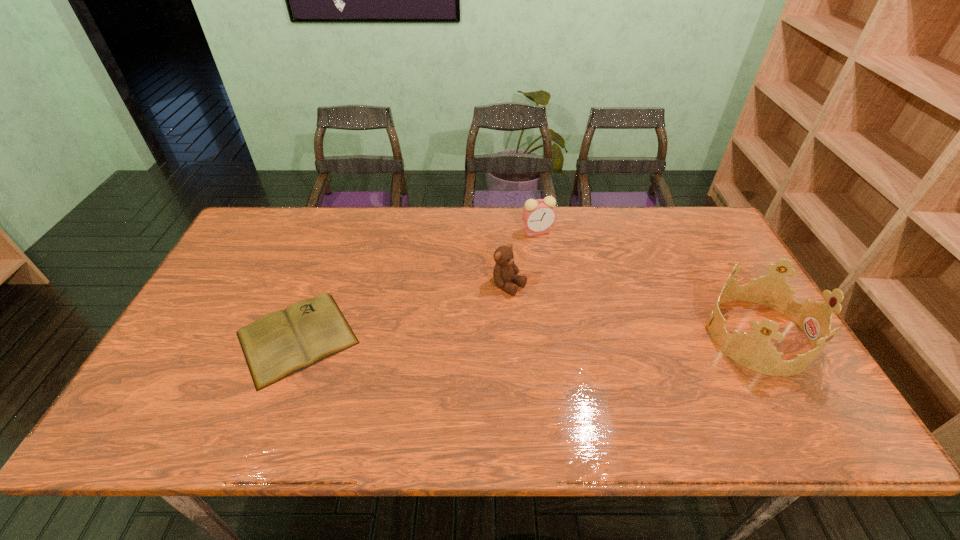
The image size is (960, 540). Identify the location of free space between the teddy bear and the farthest object. (523, 258).

Locate an element on the screen. vacant area that lies between the third object from right to left and the farthest object is located at coordinates (523, 258).

The height and width of the screenshot is (540, 960). Find the location of `free spot between the shortest object and the third object from right to left`. free spot between the shortest object and the third object from right to left is located at coordinates (403, 312).

You are a GUI agent. You are given a task and a screenshot of the screen. Output one action in this format:
    pyautogui.click(x=<x>, y=<y>)
    Task: Click on the free space between the teddy bear and the book
    The image size is (960, 540).
    Given the screenshot: What is the action you would take?
    pyautogui.click(x=403, y=312)

This screenshot has width=960, height=540. In order to click on free space that is in between the teddy bear and the book in this screenshot , I will do `click(403, 312)`.

I want to click on free space between the book and the third object from left to right, so click(x=418, y=284).

Locate which object is the second closest to the tiara. Please provide its 2D coordinates. Your answer should be formatted as a tuple, i.e. [(x, y)], where the tuple contains the x and y coordinates of a point satisfying the conditions above.

[(505, 270)]

Identify which object is the second closest to the third object from right to left. Please provide its 2D coordinates. Your answer should be formatted as a tuple, i.e. [(x, y)], where the tuple contains the x and y coordinates of a point satisfying the conditions above.

[(283, 342)]

You are a GUI agent. You are given a task and a screenshot of the screen. Output one action in this format:
    pyautogui.click(x=<x>, y=<y>)
    Task: Click on the vacant space that satisfies the following two spatial constraints: 1. on the back side of the farthest object; 2. on the right side of the second object from left to right
    This screenshot has width=960, height=540.
    Given the screenshot: What is the action you would take?
    pyautogui.click(x=506, y=231)

Locate an element on the screen. vacant position in the image that satisfies the following two spatial constraints: 1. on the front side of the alarm clock; 2. on the front-facing side of the rightmost object is located at coordinates (553, 335).